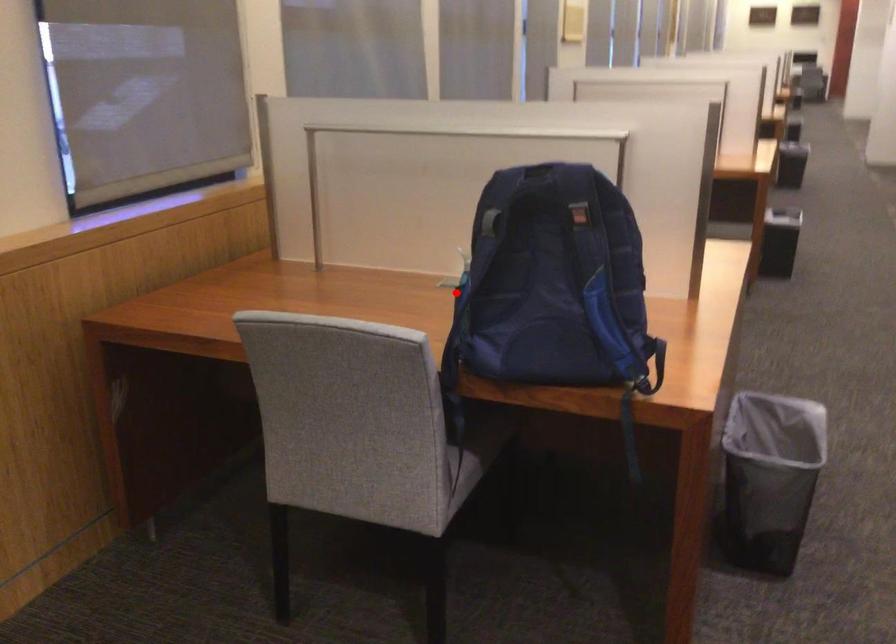
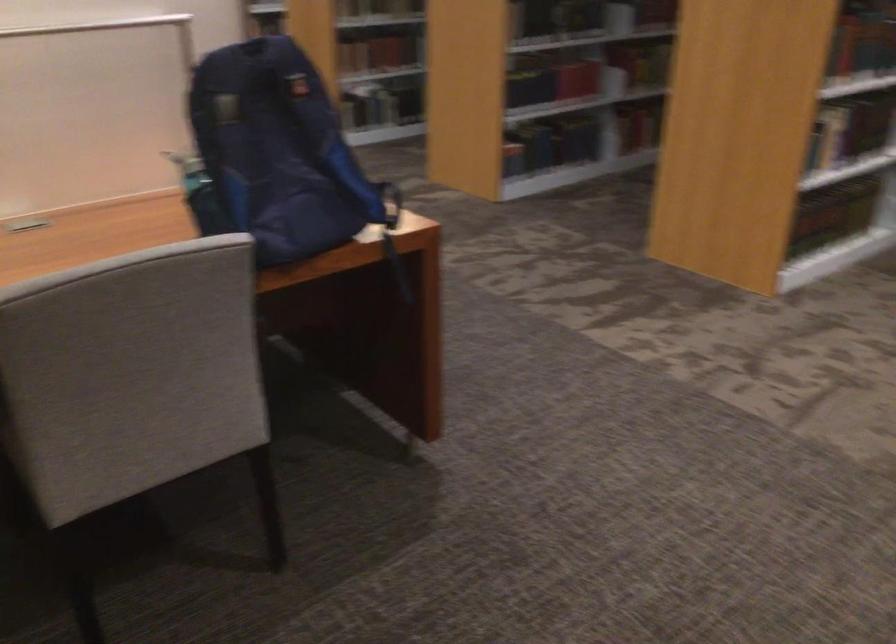
In the second image, find the point that corresponds to the highlighted location in the first image.

(200, 194)